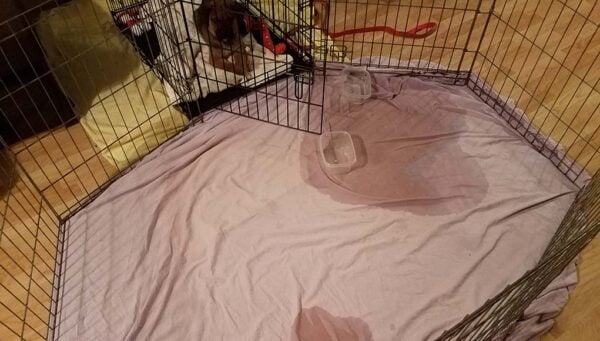
Identify the location of blanket. (391, 271).